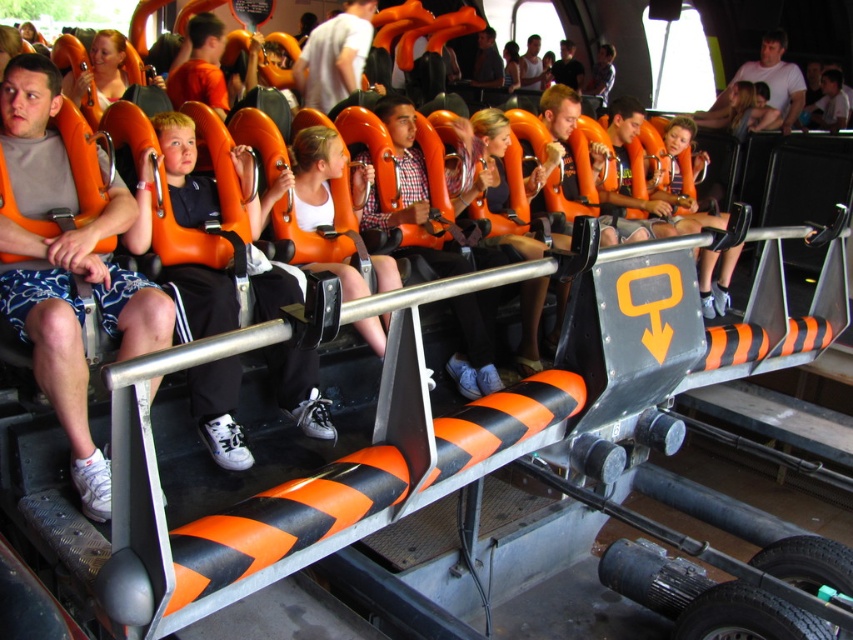
You are a safety inspector checking the roller coaster seats. You notice the matte gray shorts at left and the matte orange life vest at center. Which object is closer to the front of the roller coaster?

The matte gray shorts at left is closer to the front of the roller coaster because it is positioned in front of the matte orange life vest at center.

You are a photographer positioned at the front of the roller coaster car. You want to take a photo of the matte white shirt at center. Where should you aim your camera to capture it?

You should aim your camera at point (334, 54) to capture the matte white shirt at center as specified in the 2D location provided.